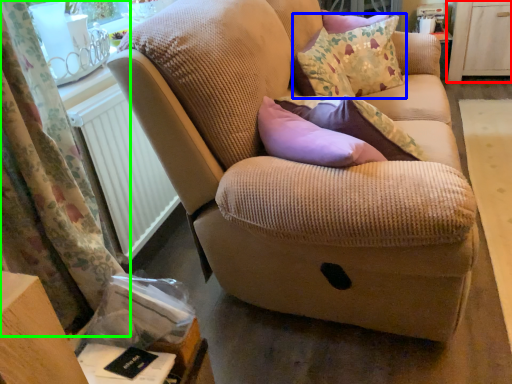
Question: Which is nearer to the dresser (highlighted by a red box)? throw pillow (highlighted by a blue box) or curtain (highlighted by a green box).

Choices:
 (A) throw pillow
 (B) curtain

Answer: (A)